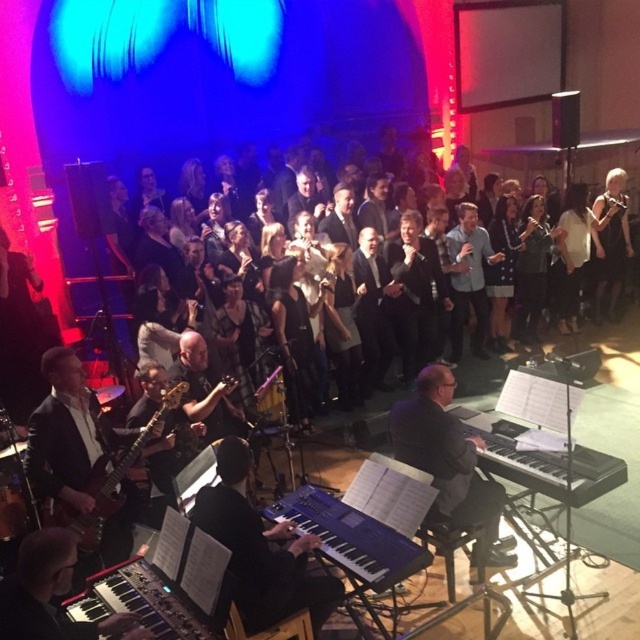
You are a stagehand setting up microphones for the band. You need to place a microphone stand between the black matte keyboard at lower left and the matte black electric guitar at lower left. Based on their positions, which instrument should the microphone stand be closer to?

The black matte keyboard at lower left is below the matte black electric guitar at lower left, so the microphone stand should be placed closer to the black matte keyboard at lower left since it is positioned lower and likely closer to the ground.